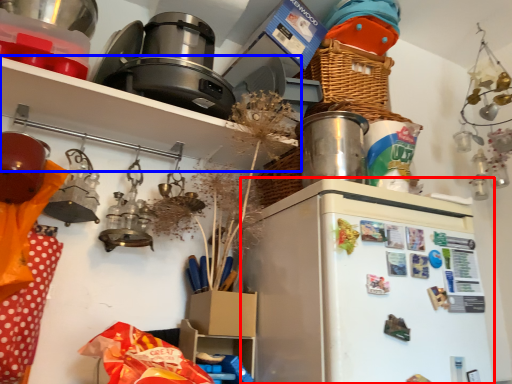
Question: Which point is closer to the camera, fridge (highlighted by a red box) or shelf (highlighted by a blue box)?

Choices:
 (A) fridge
 (B) shelf

Answer: (A)